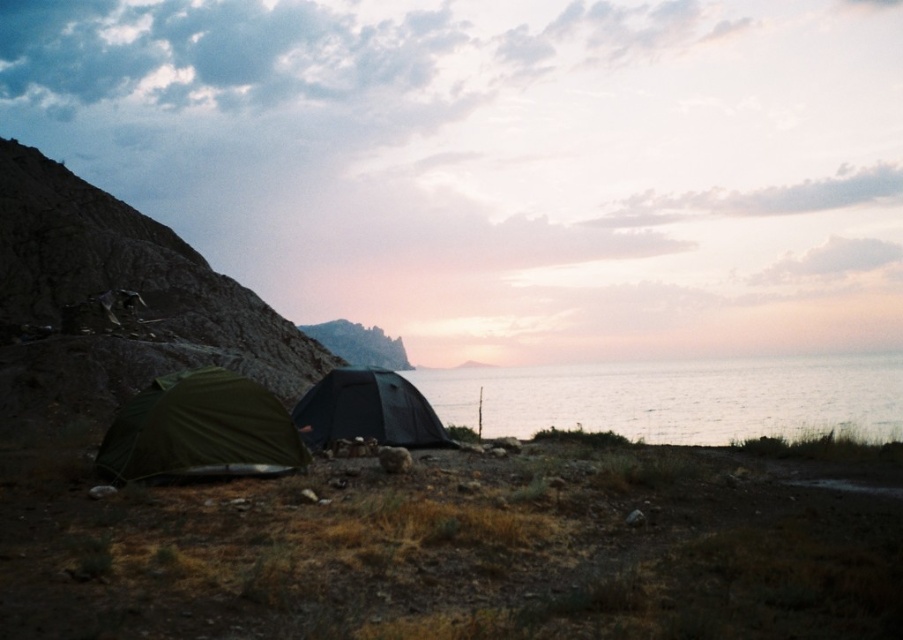
You are a hiker who just arrived at the campsite. You need to locate the silvery water at center. According to the coordinates provided, where should you look relative to the tents?

The silvery water at center is located at coordinates point (x=677, y=397), which means it is positioned to the upper right of the tents.

You are a hiker who has just set up camp and wants to refill your water bottle from the nearest water source. Which direction should you go from the green fabric tent at lower left to reach the silvery water at center?

The silvery water at center is located to the right of the green fabric tent at lower left, so you should head towards the right direction from the green fabric tent at lower left to reach the water.

You are setting up a campsite and want to place a large cooler between the green fabric tent at lower left and the black matte tent at lower left. Given their widths, which tent should the cooler be placed closer to?

The green fabric tent at lower left has a lesser width compared to the black matte tent at lower left, so the cooler should be placed closer to the black matte tent at lower left to ensure enough space.